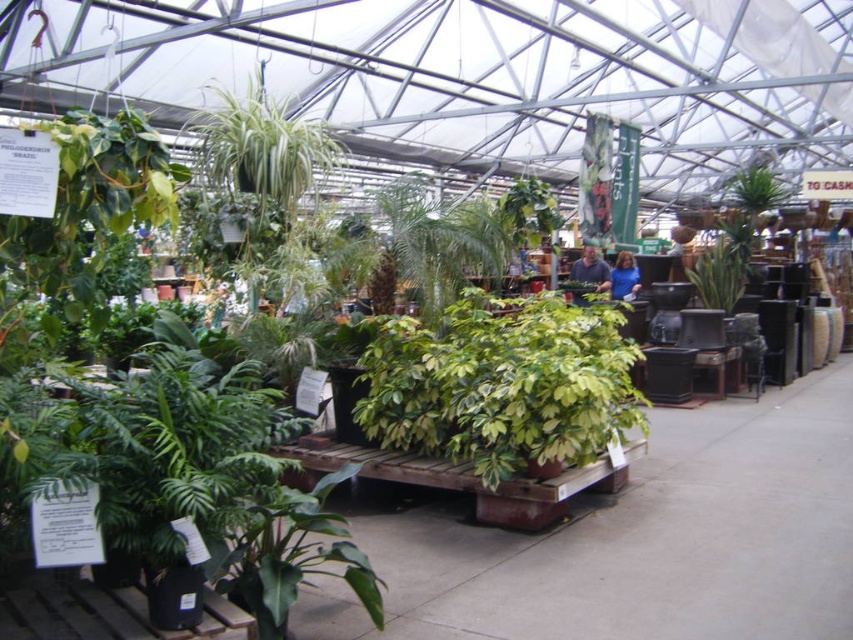
Question: Does green matte leafy plant at lower center appear under green leafy plant at upper center?

Choices:
 (A) yes
 (B) no

Answer: (A)

Question: Based on their relative distances, which object is nearer to the green matte leafy plant at lower center?

Choices:
 (A) green leafy plant at upper center
 (B) green glossy planter at center

Answer: (A)

Question: Which point is farther to the camera?

Choices:
 (A) (256, 180)
 (B) (729, 280)
 (C) (590, 378)

Answer: (B)

Question: Which object is the closest to the green matte plant at center?

Choices:
 (A) green matte leafy plant at lower center
 (B) green leafy plant at upper center

Answer: (A)

Question: Does green matte leafy plant at lower center come in front of green leafy plant at upper center?

Choices:
 (A) no
 (B) yes

Answer: (B)

Question: Considering the relative positions of green matte plant at center and green glossy planter at center in the image provided, where is green matte plant at center located with respect to green glossy planter at center?

Choices:
 (A) above
 (B) below

Answer: (B)